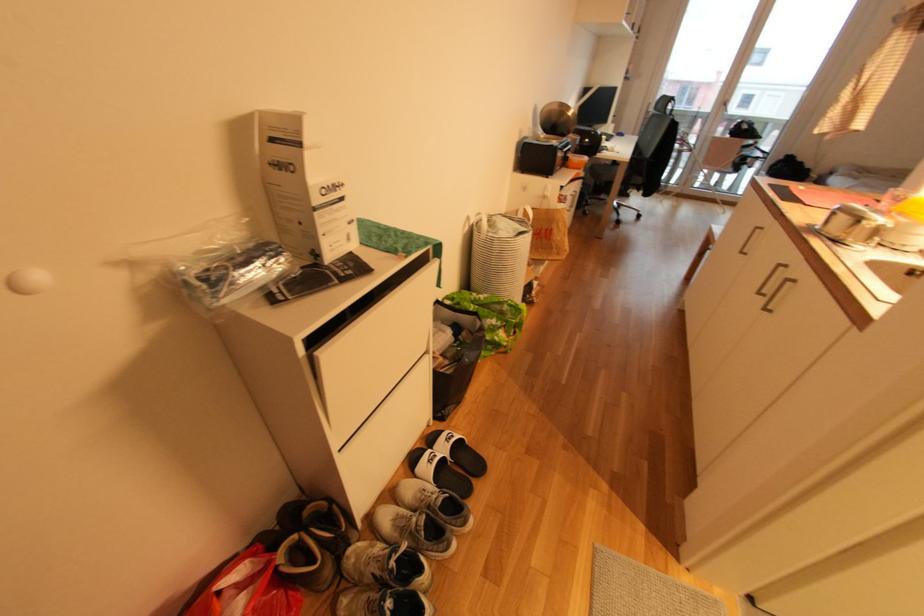
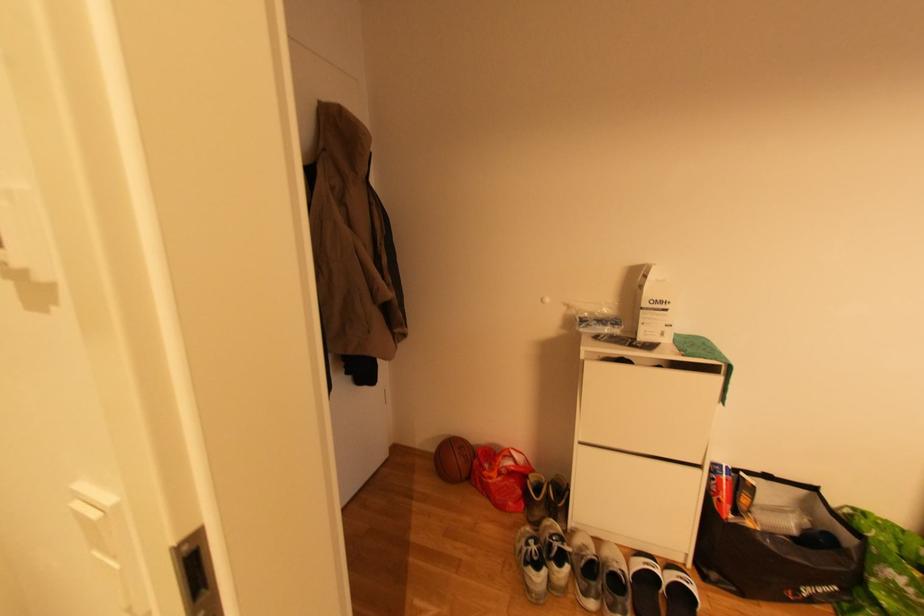
Question: The camera is either moving clockwise (left) or counter-clockwise (right) around the object. The first image is from the beginning of the video and the second image is from the end. Is the camera moving left or right when shooting the video?

Choices:
 (A) Left
 (B) Right

Answer: (B)